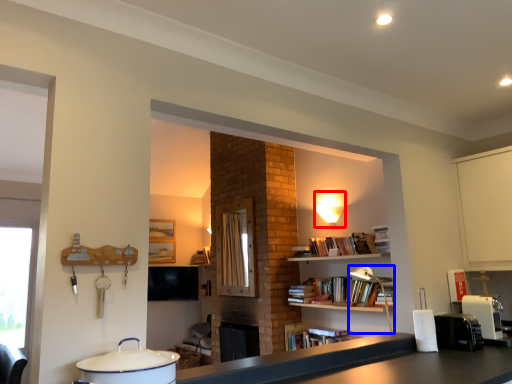
Question: Which object is further to the camera taking this photo, light fixture (highlighted by a red box) or lamp (highlighted by a blue box)?

Choices:
 (A) light fixture
 (B) lamp

Answer: (A)